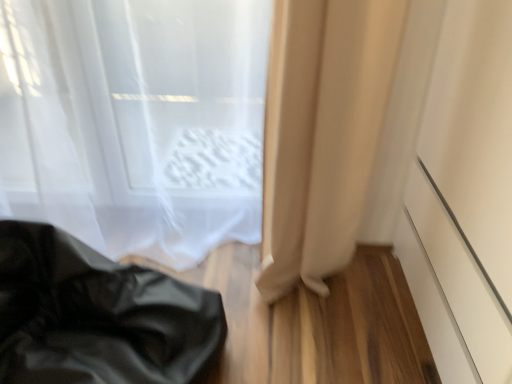
Question: Could you tell me if white matte screen door at right is facing translucent fabric curtain at upper left, which is counted as the 2th curtain, starting from the right?

Choices:
 (A) no
 (B) yes

Answer: (B)

Question: From a real-world perspective, is white matte screen door at right physically above translucent fabric curtain at upper left, which is counted as the 2th curtain, starting from the right?

Choices:
 (A) yes
 (B) no

Answer: (A)

Question: Can you confirm if white matte screen door at right is bigger than translucent fabric curtain at upper left, which is counted as the 2th curtain, starting from the right?

Choices:
 (A) yes
 (B) no

Answer: (A)

Question: Can you confirm if white matte screen door at right is smaller than translucent fabric curtain at upper left, the 1th curtain positioned from the left?

Choices:
 (A) no
 (B) yes

Answer: (A)

Question: Does white matte screen door at right appear on the right side of translucent fabric curtain at upper left, the 1th curtain positioned from the left?

Choices:
 (A) no
 (B) yes

Answer: (B)

Question: In terms of size, does beige fabric curtain at lower right, positioned as the 1th curtain in right-to-left order, appear bigger or smaller than white matte screen door at right?

Choices:
 (A) small
 (B) big

Answer: (A)

Question: Is beige fabric curtain at lower right, positioned as the 1th curtain in right-to-left order, in front of or behind white matte screen door at right in the image?

Choices:
 (A) front
 (B) behind

Answer: (B)

Question: From the image's perspective, is beige fabric curtain at lower right, positioned as the 1th curtain in right-to-left order, located above or below white matte screen door at right?

Choices:
 (A) above
 (B) below

Answer: (A)

Question: From a real-world perspective, is beige fabric curtain at lower right, which is counted as the second curtain, starting from the left, above or below white matte screen door at right?

Choices:
 (A) below
 (B) above

Answer: (A)

Question: Does point (452, 155) appear closer or farther from the camera than point (50, 1)?

Choices:
 (A) closer
 (B) farther

Answer: (B)

Question: Relative to translucent fabric curtain at upper left, the 1th curtain positioned from the left, is white matte screen door at right in front or behind?

Choices:
 (A) front
 (B) behind

Answer: (A)

Question: Considering the positions of white matte screen door at right and translucent fabric curtain at upper left, which is counted as the 2th curtain, starting from the right, in the image, is white matte screen door at right wider or thinner than translucent fabric curtain at upper left, which is counted as the 2th curtain, starting from the right,?

Choices:
 (A) wide
 (B) thin

Answer: (A)

Question: Which is correct: white matte screen door at right is inside translucent fabric curtain at upper left, the 1th curtain positioned from the left, or outside of it?

Choices:
 (A) inside
 (B) outside

Answer: (B)

Question: Considering the relative positions of black leather bag at lower left and translucent fabric curtain at upper left, the 1th curtain positioned from the left, in the image provided, is black leather bag at lower left to the left or to the right of translucent fabric curtain at upper left, the 1th curtain positioned from the left,?

Choices:
 (A) left
 (B) right

Answer: (A)

Question: In terms of width, does black leather bag at lower left look wider or thinner when compared to translucent fabric curtain at upper left, the 1th curtain positioned from the left?

Choices:
 (A) wide
 (B) thin

Answer: (A)